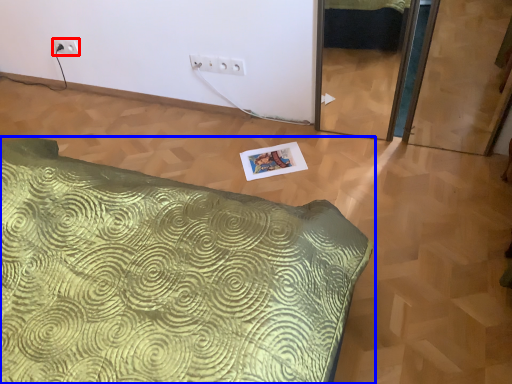
Question: Which object appears farthest to the camera in this image, electric outlet (highlighted by a red box) or bed (highlighted by a blue box)?

Choices:
 (A) electric outlet
 (B) bed

Answer: (A)